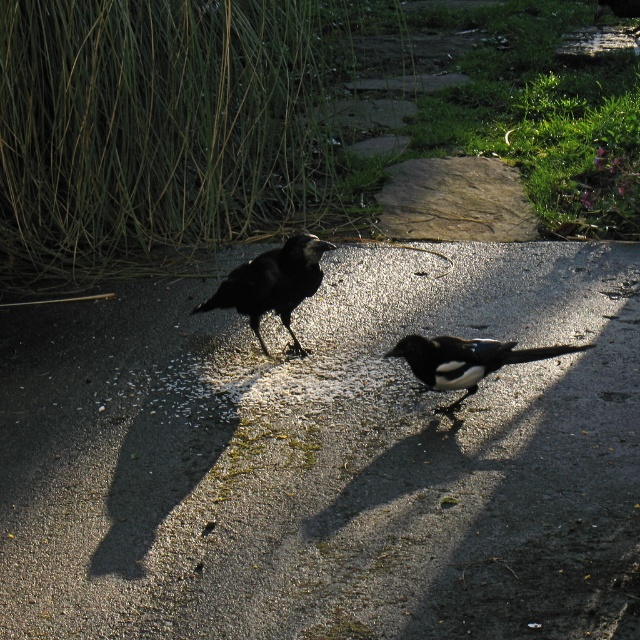
You are a photographer standing on the pathway wanting to take a photo of the glossy asphalt at center and the white glossy magpie at center. Which object will appear larger in your photo?

The glossy asphalt at center will appear larger in the photo because it is closer to the viewer than the white glossy magpie at center.

You are standing at the point marked as point (236,282). You want to reach the magpie on the right without getting your shoes wet. The path has puddles. Can you walk straight to the magpie?

The magpie is 14.79 feet away from point (236,282). Since the path has puddles, you need to check the puddles between you and the magpie. However, the description does not specify the puddles location or size, so it is uncertain if you can walk straight without getting wet.

You are a photographer trying to capture both the glossy asphalt at center and the shiny black crow at center in a single frame. Given that your camera can only focus on objects within a 1.5 meter width, will both objects fit in the frame if they are positioned side by side?

The glossy asphalt at center is wider than the shiny black crow at center. Since the camera can focus on objects within a 1.5 meter width, both objects can fit in the frame as long as their combined width does not exceed 1.5 meters. However, the exact fit depends on the individual widths of each object, which are not specified here.